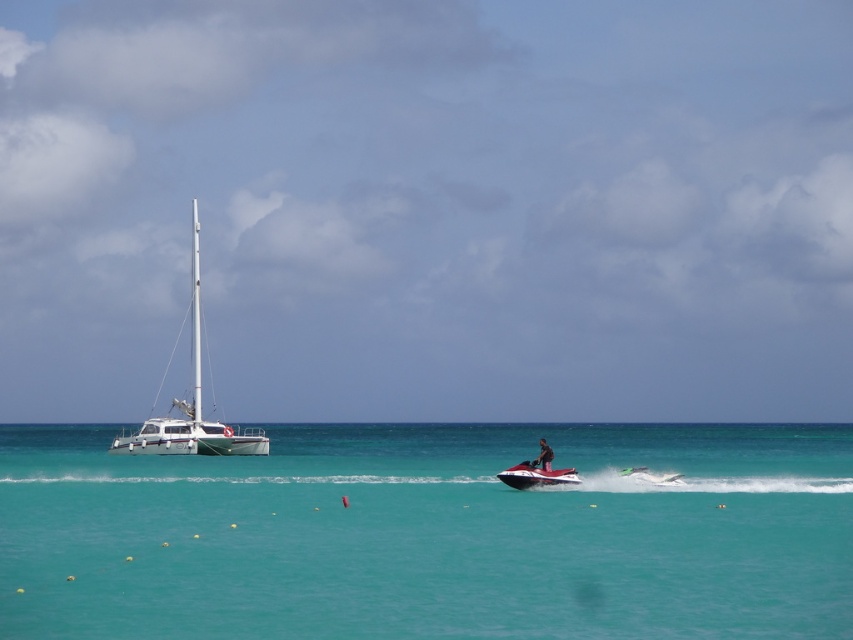
Identify the location of turquoise glossy water at center. The image size is (853, 640). (428, 534).

Which is behind, point (355, 625) or point (219, 448)?

The point (219, 448) is more distant.

Between point (54, 616) and point (193, 326), which one is positioned behind?

Point (193, 326)

Find the location of a particular element. The width and height of the screenshot is (853, 640). turquoise glossy water at center is located at coordinates (428, 534).

Between turquoise glossy water at center and shiny black jet ski at center, which one is positioned higher?

shiny black jet ski at center

Is point (36, 586) positioned after point (532, 483)?

No, it is not.

Is point (15, 464) closer to viewer compared to point (566, 477)?

No, it is not.

Identify the location of turquoise glossy water at center. (428, 534).

Does white glossy sailboat at left appear on the left side of dark skin human at center?

Indeed, white glossy sailboat at left is positioned on the left side of dark skin human at center.

Which is behind, point (195, 257) or point (541, 445)?

The point (195, 257) is behind.

Find the location of a particular element. white glossy sailboat at left is located at coordinates (189, 403).

In order to click on white glossy sailboat at left in this screenshot , I will do `click(189, 403)`.